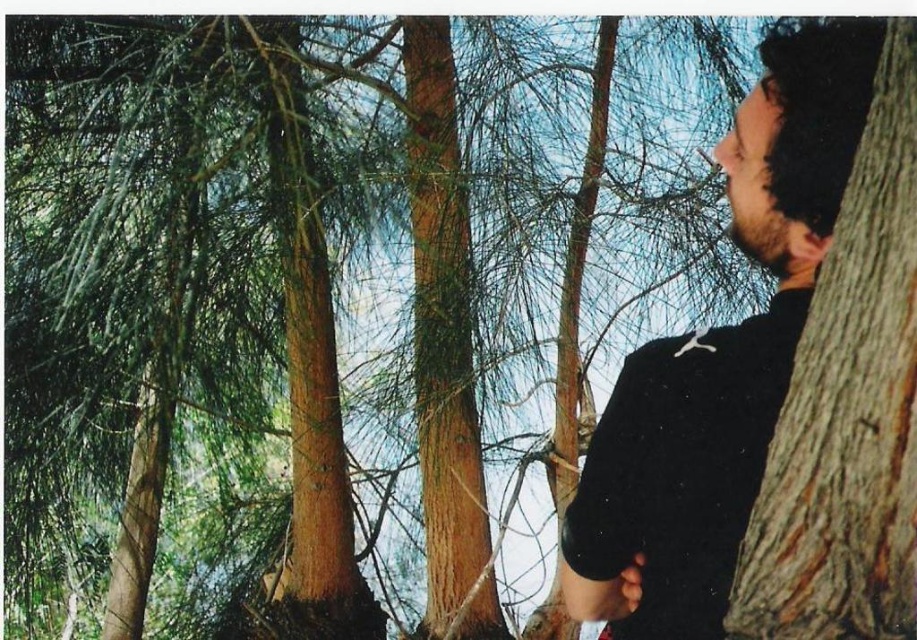
Measure the distance between point [831,141] and camera.

A distance of 38.07 inches exists between point [831,141] and camera.

Which is in front, point (691, 433) or point (467, 577)?

Point (691, 433) is in front.

Where is `black matte shirt at right`? Image resolution: width=917 pixels, height=640 pixels. black matte shirt at right is located at coordinates (719, 358).